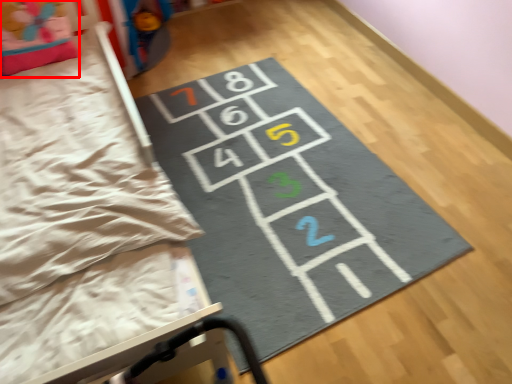
Question: From the image's perspective, what is the correct spatial positioning of pillow (annotated by the red box) in reference to yoga mat?

Choices:
 (A) above
 (B) below

Answer: (A)